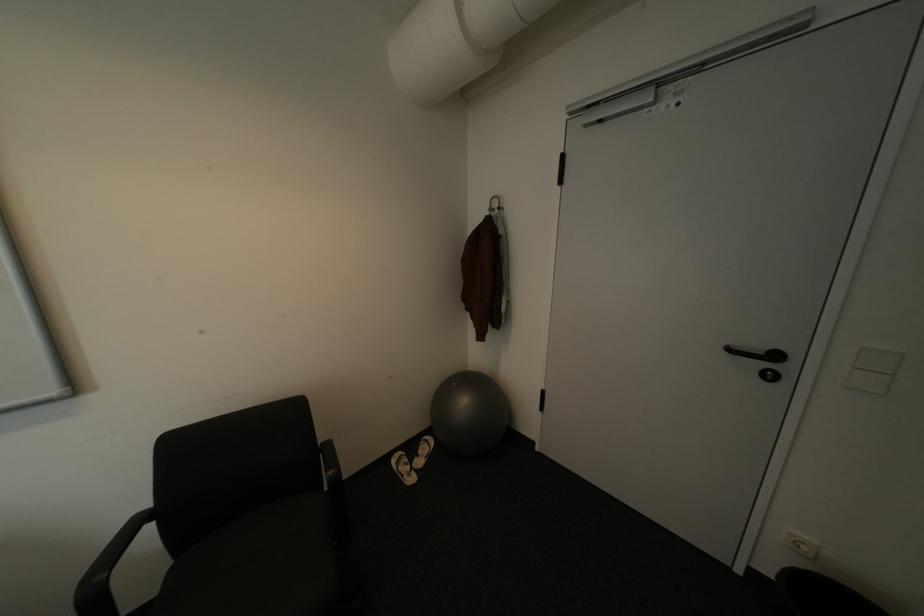
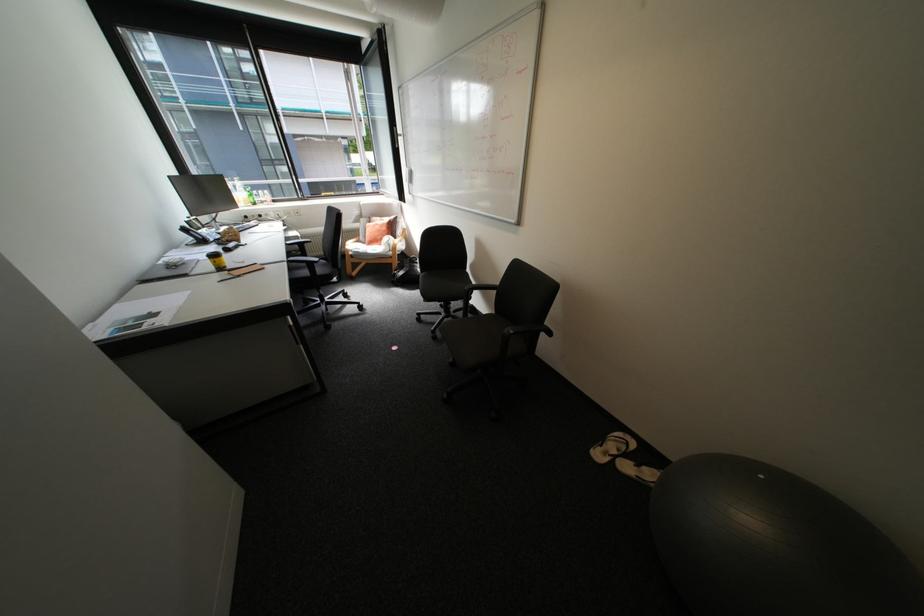
The point at (x=428, y=456) is marked in the first image. Where is the corresponding point in the second image?

(645, 464)